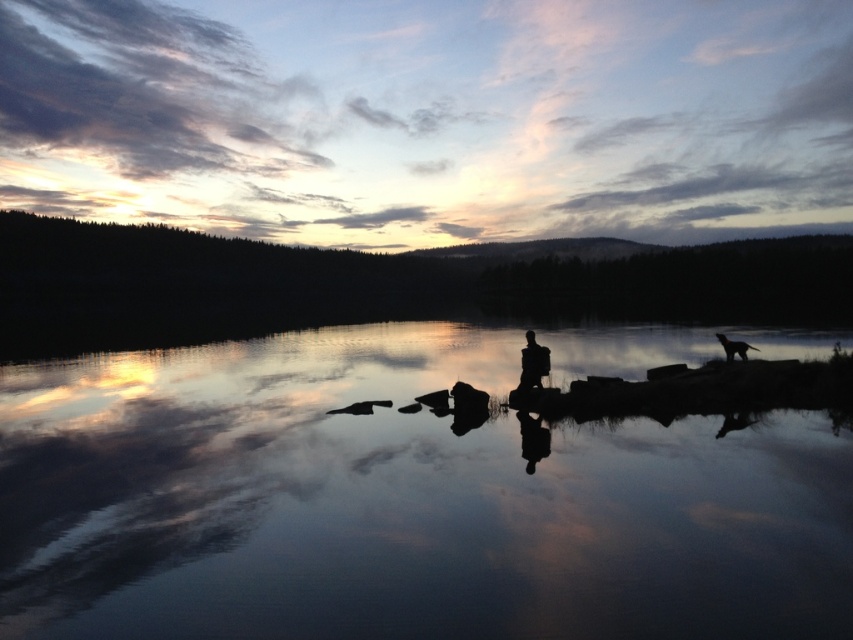
Question: Which of the following is the farthest from the observer?

Choices:
 (A) (674, 564)
 (B) (743, 353)

Answer: (B)

Question: Which point is farther to the camera?

Choices:
 (A) silhouette figure at right
 (B) silhouette figure at center

Answer: (A)

Question: Which point is closer to the camera?

Choices:
 (A) (790, 516)
 (B) (532, 356)

Answer: (A)

Question: Is smooth reflective water at center smaller than silhouette figure at center?

Choices:
 (A) no
 (B) yes

Answer: (A)

Question: Is smooth reflective water at center below silhouette figure at center?

Choices:
 (A) no
 (B) yes

Answer: (B)

Question: Is smooth reflective water at center bigger than silhouette figure at right?

Choices:
 (A) no
 (B) yes

Answer: (B)